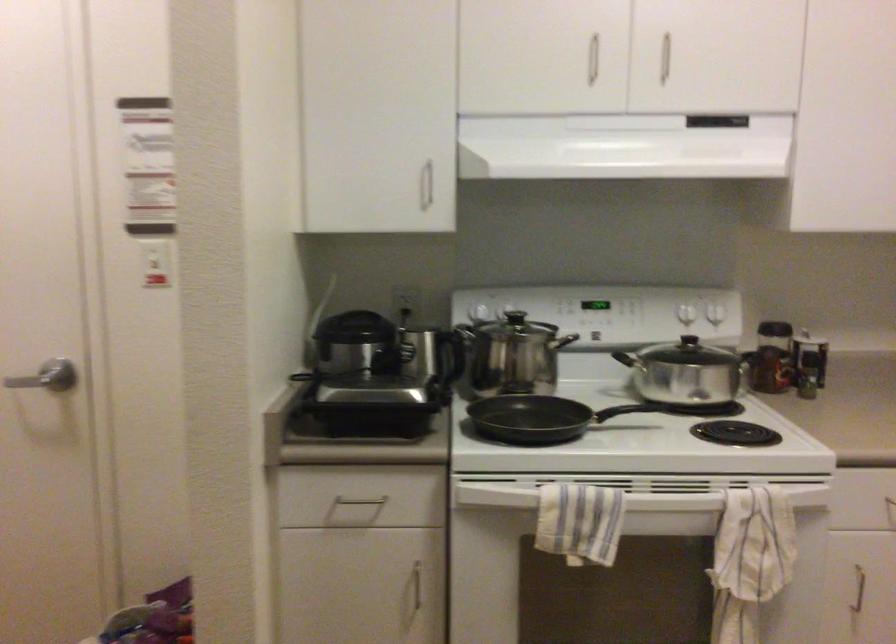
Describe the element at coordinates (156, 277) in the screenshot. I see `the red light switch` at that location.